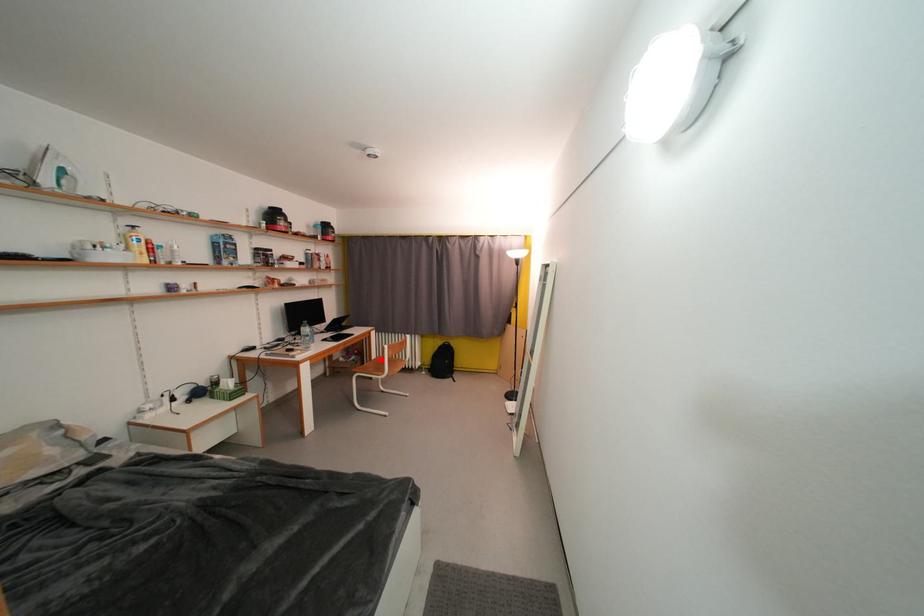
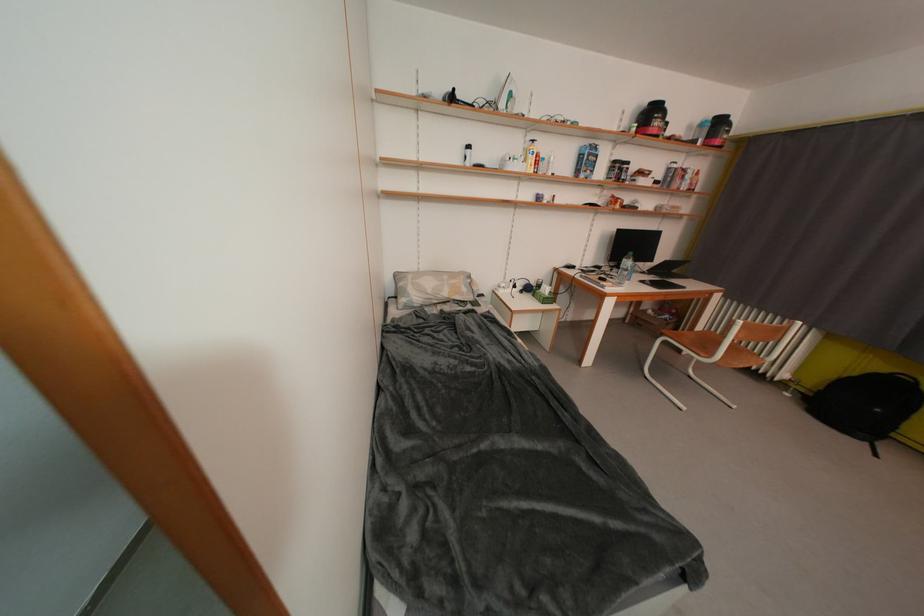
Locate, in the second image, the point that corresponds to the highlighted location in the first image.

(708, 331)